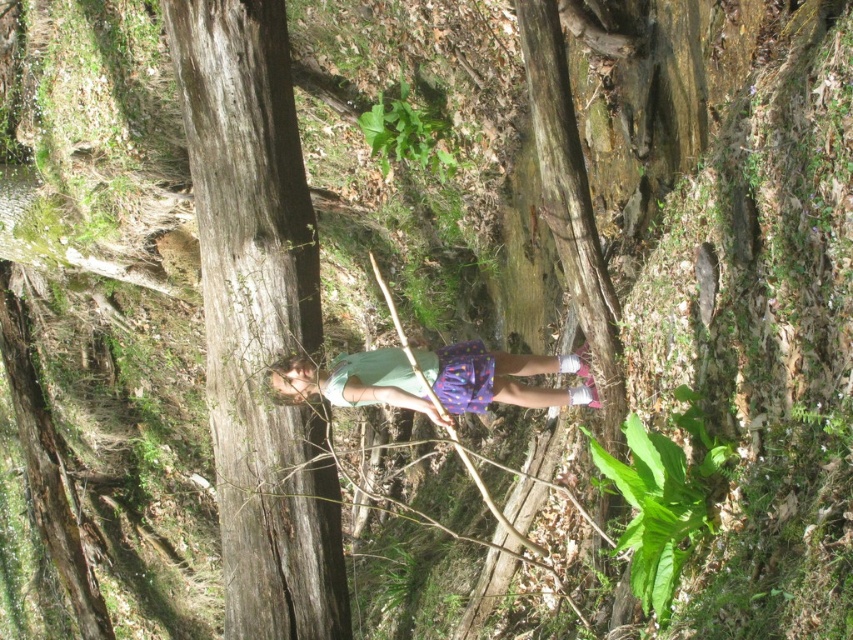
What do you see at coordinates (258, 320) in the screenshot?
I see `smooth brown tree trunk at left` at bounding box center [258, 320].

Is smooth brown tree trunk at left below multicolored fabric shorts at center?

Actually, smooth brown tree trunk at left is above multicolored fabric shorts at center.

Is point (230, 609) positioned in front of point (289, 385)?

No, (230, 609) is further to viewer.

At what (x,y) coordinates should I click in order to perform the action: click on smooth brown tree trunk at left. Please return your answer as a coordinate pair (x, y). The image size is (853, 640). Looking at the image, I should click on (258, 320).